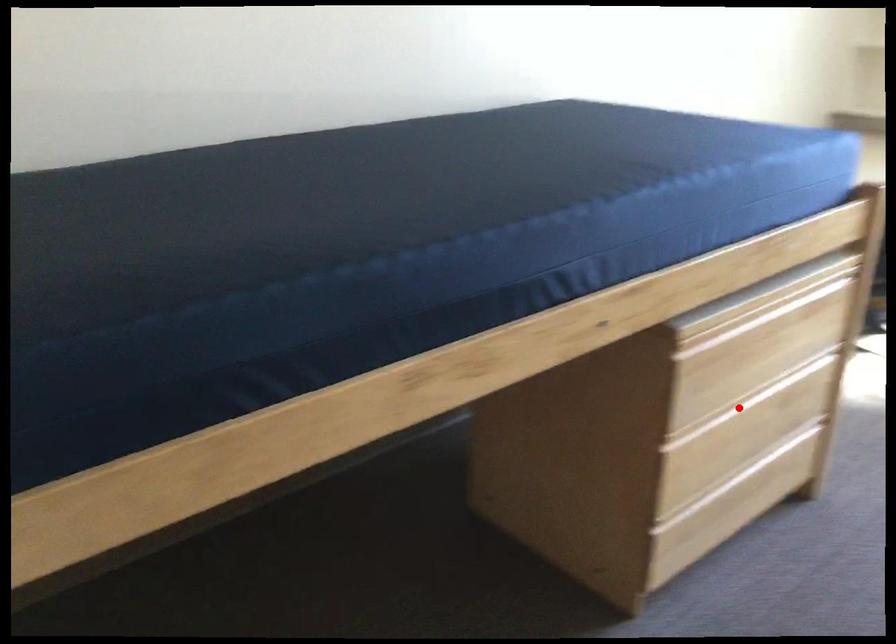
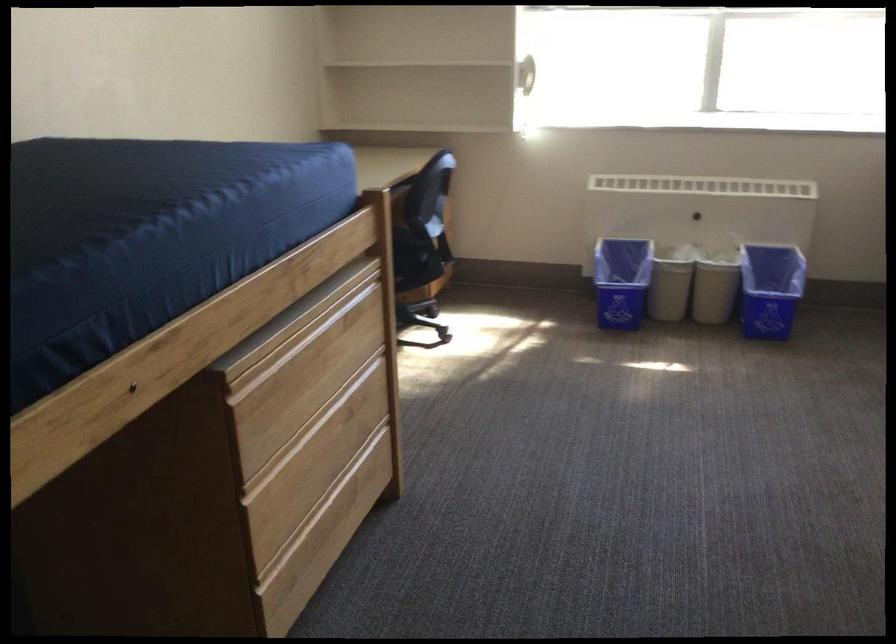
Find the pixel in the second image that matches the highlighted location in the first image.

(307, 431)